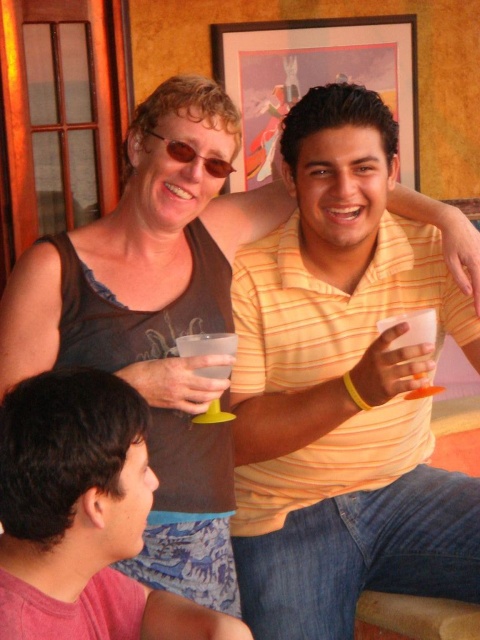
You are at a social gathering and see a point marked at coordinates (83, 515). Which object from the scene does this point belong to?

The point at coordinates (83, 515) belongs to the pink fabric shirt at lower left.

You are at a party and want to place your clear plastic cup at upper center and matte brown sunglasses at upper center on a narrow shelf. Which item will fit better on the shelf?

The clear plastic cup at upper center is thinner than the matte brown sunglasses at upper center, so it will fit better on the narrow shelf.